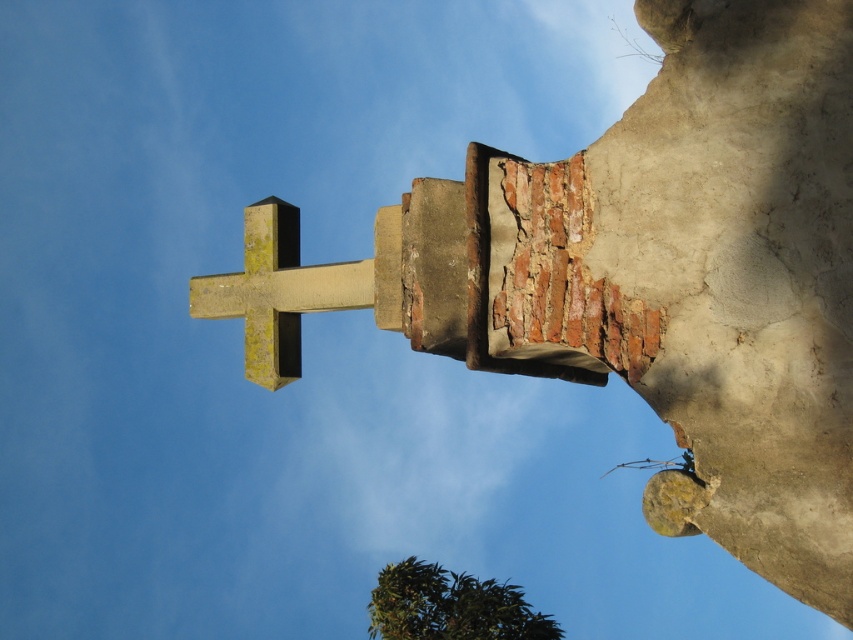
Question: Which point is closer to the camera taking this photo?

Choices:
 (A) (517, 604)
 (B) (363, 292)

Answer: (B)

Question: Where is green mossy stone cross at center located in relation to green leafy tree at lower center in the image?

Choices:
 (A) below
 (B) above

Answer: (B)

Question: Is green mossy stone cross at center bigger than green leafy tree at lower center?

Choices:
 (A) yes
 (B) no

Answer: (A)

Question: Does green mossy stone cross at center have a lesser width compared to green leafy tree at lower center?

Choices:
 (A) yes
 (B) no

Answer: (A)

Question: Which point is closer to the camera?

Choices:
 (A) (486, 636)
 (B) (329, 264)

Answer: (B)